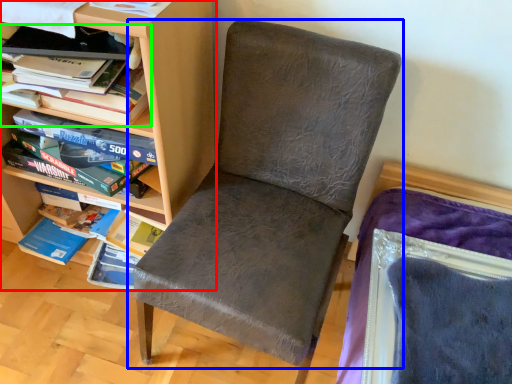
Question: Based on their relative distances, which object is nearer to shelf (highlighted by a red box)? Choose from chair (highlighted by a blue box) and book (highlighted by a green box).

Choices:
 (A) chair
 (B) book

Answer: (B)